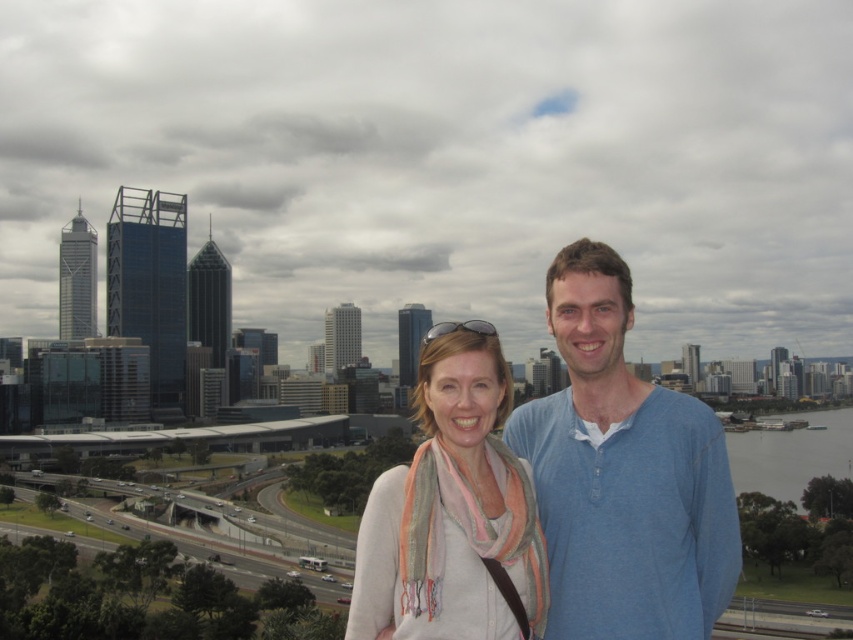
You are a photographer trying to capture the blue cotton shirt at center in the image. What are the exact coordinates where you should focus your camera?

The blue cotton shirt at center is located at coordinates point (624, 474).

Looking at this image, you are a photographer taking a picture of two people in an urban setting. You notice the blue cotton shirt at center and the white soft scarf at center. Which item is located to the left of the other?

The white soft scarf at center is to the left of the blue cotton shirt at center because the blue cotton shirt at center is positioned on the right side of white soft scarf at center.

You are standing at a scenic spot in the city and want to take a photo of the point at coordinates point (573, 392). If your camera has a maximum focus range of 600 meters, will it be able to focus on that point?

The distance of point (573, 392) from viewer is 626.54 meters, which exceeds the camera maximum focus range of 600 meters. The camera will not be able to focus on that point.